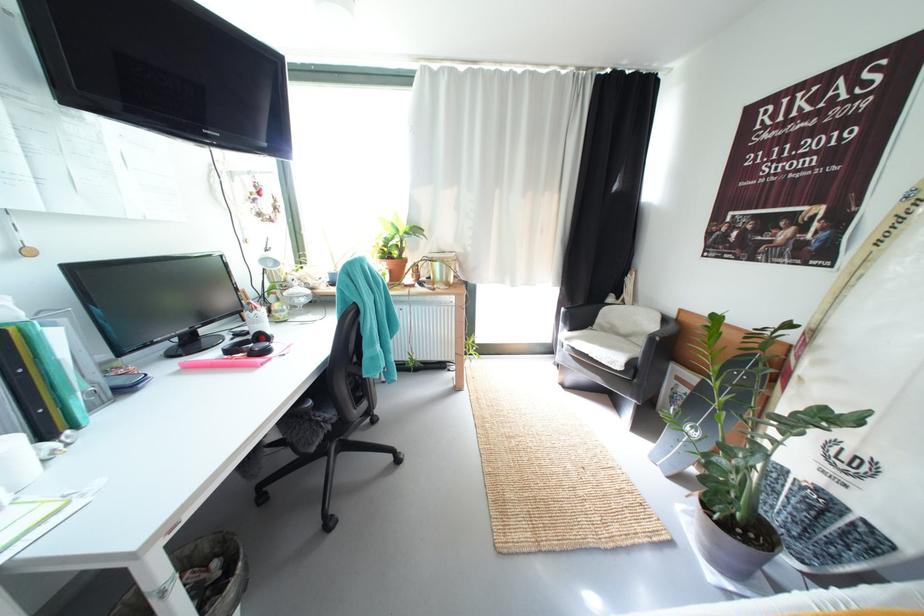
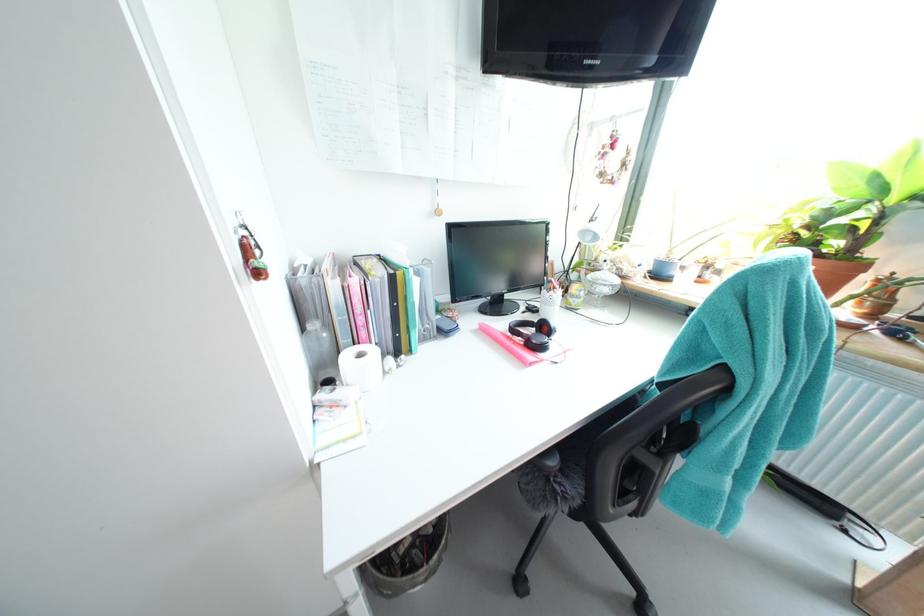
The first image is from the beginning of the video and the second image is from the end. How did the camera likely rotate when shooting the video?

The rotation direction of the camera is left-down.